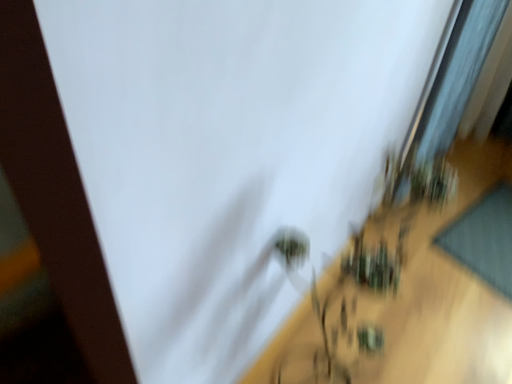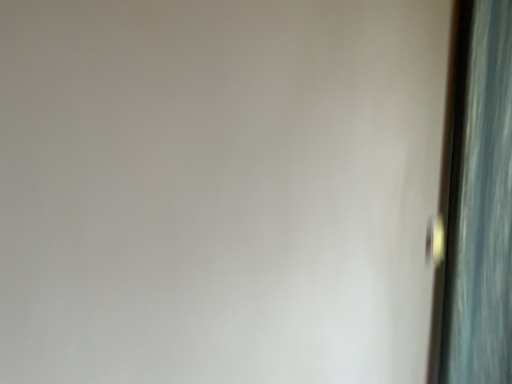
Question: Which way did the camera rotate in the video?

Choices:
 (A) rotated left
 (B) rotated right

Answer: (A)